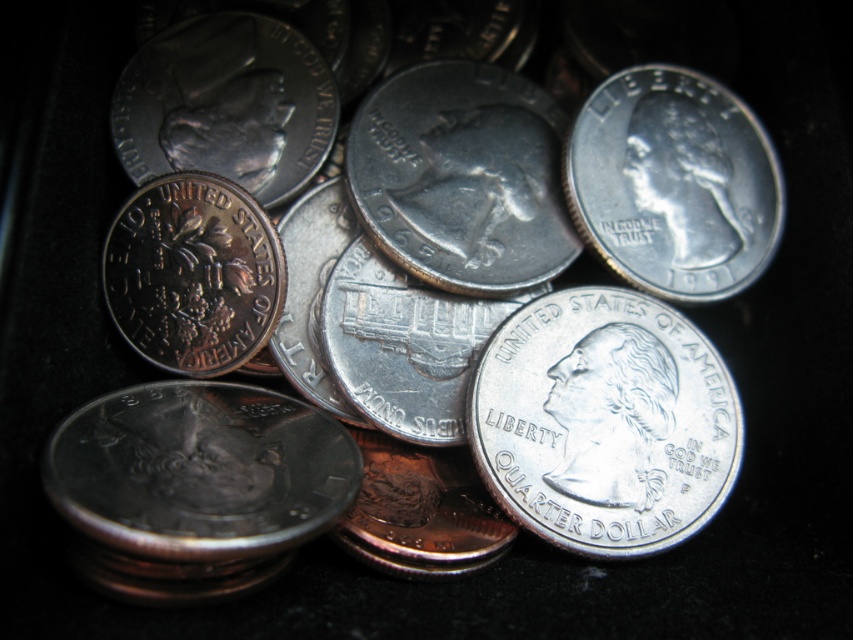
Question: Where is silver/reflective quarter dollar at center located in relation to silver/reflective quarter dollar at upper right in the image?

Choices:
 (A) above
 (B) below

Answer: (B)

Question: Is silver/reflective quarter dollar at center wider than silver/reflective quarter dollar at upper right?

Choices:
 (A) yes
 (B) no

Answer: (A)

Question: Among these objects, which one is farthest from the camera?

Choices:
 (A) silver/reflective quarter dollar at center
 (B) silver/reflective quarter dollar at upper right

Answer: (B)

Question: Can you confirm if silver/reflective quarter dollar at center is thinner than silver/reflective quarter dollar at upper right?

Choices:
 (A) yes
 (B) no

Answer: (B)